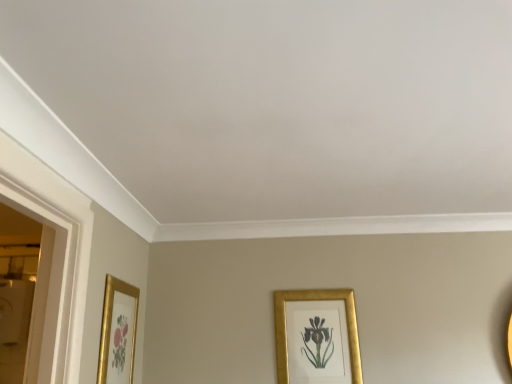
What do you see at coordinates (118, 332) in the screenshot?
I see `gold metallic picture frame at lower left, the 2th picture frame positioned from the back` at bounding box center [118, 332].

Find the location of a particular element. Image resolution: width=512 pixels, height=384 pixels. gold metallic picture frame at lower left, arranged as the second picture frame when viewed from the right is located at coordinates (118, 332).

Where is `gold metallic picture frame at lower center, marked as the second picture frame in a front-to-back arrangement`? The image size is (512, 384). gold metallic picture frame at lower center, marked as the second picture frame in a front-to-back arrangement is located at coordinates (317, 337).

Image resolution: width=512 pixels, height=384 pixels. What do you see at coordinates (317, 337) in the screenshot?
I see `gold metallic picture frame at lower center, which is the 1th picture frame in right-to-left order` at bounding box center [317, 337].

Image resolution: width=512 pixels, height=384 pixels. Find the location of `gold metallic picture frame at lower left, the 2th picture frame positioned from the back`. gold metallic picture frame at lower left, the 2th picture frame positioned from the back is located at coordinates (118, 332).

Does gold metallic picture frame at lower left, arranged as the second picture frame when viewed from the right, appear on the right side of gold metallic picture frame at lower center, marked as the second picture frame in a front-to-back arrangement?

Incorrect, gold metallic picture frame at lower left, arranged as the second picture frame when viewed from the right, is not on the right side of gold metallic picture frame at lower center, marked as the second picture frame in a front-to-back arrangement.

Considering the relative positions of gold metallic picture frame at lower left, the 2th picture frame positioned from the back, and gold metallic picture frame at lower center, which is the 1th picture frame in right-to-left order, in the image provided, is gold metallic picture frame at lower left, the 2th picture frame positioned from the back, behind gold metallic picture frame at lower center, which is the 1th picture frame in right-to-left order,?

No.

Does point (106, 306) come in front of point (302, 374)?

Yes, point (106, 306) is closer to viewer.

From the image's perspective, is gold metallic picture frame at lower left, the 1th picture frame viewed from the left, over gold metallic picture frame at lower center, marked as the first picture frame in a back-to-front arrangement?

Yes.

From a real-world perspective, is gold metallic picture frame at lower left, which ranks as the 1th picture frame in front-to-back order, physically located above or below gold metallic picture frame at lower center, marked as the second picture frame in a front-to-back arrangement?

Clearly, from a real-world perspective, gold metallic picture frame at lower left, which ranks as the 1th picture frame in front-to-back order, is above gold metallic picture frame at lower center, marked as the second picture frame in a front-to-back arrangement.

Is gold metallic picture frame at lower left, arranged as the second picture frame when viewed from the right, wider than gold metallic picture frame at lower center, marked as the first picture frame in a back-to-front arrangement?

No, gold metallic picture frame at lower left, arranged as the second picture frame when viewed from the right, is not wider than gold metallic picture frame at lower center, marked as the first picture frame in a back-to-front arrangement.

Based on the photo, who is taller, gold metallic picture frame at lower left, the 1th picture frame viewed from the left, or gold metallic picture frame at lower center, which is the 1th picture frame in right-to-left order?

With more height is gold metallic picture frame at lower center, which is the 1th picture frame in right-to-left order.

Based on the photo, between gold metallic picture frame at lower left, which ranks as the 1th picture frame in front-to-back order, and gold metallic picture frame at lower center, which is the 1th picture frame in right-to-left order, which one has smaller size?

With smaller size is gold metallic picture frame at lower left, which ranks as the 1th picture frame in front-to-back order.

Is gold metallic picture frame at lower left, arranged as the second picture frame when viewed from the right, positioned beyond the bounds of gold metallic picture frame at lower center, which is the 1th picture frame in right-to-left order?

Yes, gold metallic picture frame at lower left, arranged as the second picture frame when viewed from the right, is outside of gold metallic picture frame at lower center, which is the 1th picture frame in right-to-left order.

Would you consider gold metallic picture frame at lower left, the 1th picture frame viewed from the left, to be distant from gold metallic picture frame at lower center, which is the 1th picture frame in right-to-left order?

No.

Is gold metallic picture frame at lower left, the 2th picture frame positioned from the back, turned away from gold metallic picture frame at lower center, placed as the 2th picture frame when sorted from left to right?

No, gold metallic picture frame at lower left, the 2th picture frame positioned from the back,'s orientation is not away from gold metallic picture frame at lower center, placed as the 2th picture frame when sorted from left to right.

How many degrees apart are the facing directions of gold metallic picture frame at lower left, arranged as the second picture frame when viewed from the right, and gold metallic picture frame at lower center, placed as the 2th picture frame when sorted from left to right?

They differ by 89.2 degrees in their facing directions.

Consider the image. Measure the distance between gold metallic picture frame at lower left, which ranks as the 1th picture frame in front-to-back order, and gold metallic picture frame at lower center, marked as the first picture frame in a back-to-front arrangement.

A distance of 27.79 inches exists between gold metallic picture frame at lower left, which ranks as the 1th picture frame in front-to-back order, and gold metallic picture frame at lower center, marked as the first picture frame in a back-to-front arrangement.

Identify the location of picture frame behind the gold metallic picture frame at lower left, the 2th picture frame positioned from the back. (317, 337).

Between gold metallic picture frame at lower center, which is the 1th picture frame in right-to-left order, and gold metallic picture frame at lower left, arranged as the second picture frame when viewed from the right, which one appears on the right side from the viewer's perspective?

From the viewer's perspective, gold metallic picture frame at lower center, which is the 1th picture frame in right-to-left order, appears more on the right side.

Considering their positions, is gold metallic picture frame at lower center, which is the 1th picture frame in right-to-left order, located in front of or behind gold metallic picture frame at lower left, arranged as the second picture frame when viewed from the right?

gold metallic picture frame at lower center, which is the 1th picture frame in right-to-left order, is positioned farther from the viewer than gold metallic picture frame at lower left, arranged as the second picture frame when viewed from the right.

Between point (362, 380) and point (133, 321), which one is positioned in front?

Positioned in front is point (133, 321).

In the scene shown: From the image's perspective, does gold metallic picture frame at lower center, marked as the first picture frame in a back-to-front arrangement, appear lower than gold metallic picture frame at lower left, the 2th picture frame positioned from the back?

Yes, from the image's perspective, gold metallic picture frame at lower center, marked as the first picture frame in a back-to-front arrangement, is below gold metallic picture frame at lower left, the 2th picture frame positioned from the back.

From a real-world perspective, which is physically below, gold metallic picture frame at lower center, which is the 1th picture frame in right-to-left order, or gold metallic picture frame at lower left, the 2th picture frame positioned from the back?

gold metallic picture frame at lower center, which is the 1th picture frame in right-to-left order.

Which of these two, gold metallic picture frame at lower center, marked as the first picture frame in a back-to-front arrangement, or gold metallic picture frame at lower left, the 1th picture frame viewed from the left, is wider?

gold metallic picture frame at lower center, marked as the first picture frame in a back-to-front arrangement, is wider.

Considering the sizes of gold metallic picture frame at lower center, placed as the 2th picture frame when sorted from left to right, and gold metallic picture frame at lower left, the 2th picture frame positioned from the back, in the image, is gold metallic picture frame at lower center, placed as the 2th picture frame when sorted from left to right, taller or shorter than gold metallic picture frame at lower left, the 2th picture frame positioned from the back,?

In the image, gold metallic picture frame at lower center, placed as the 2th picture frame when sorted from left to right, appears to be taller than gold metallic picture frame at lower left, the 2th picture frame positioned from the back.

Which of these two, gold metallic picture frame at lower center, which is the 1th picture frame in right-to-left order, or gold metallic picture frame at lower left, the 2th picture frame positioned from the back, is bigger?

With larger size is gold metallic picture frame at lower center, which is the 1th picture frame in right-to-left order.

Would you say gold metallic picture frame at lower center, placed as the 2th picture frame when sorted from left to right, is inside or outside gold metallic picture frame at lower left, the 2th picture frame positioned from the back?

gold metallic picture frame at lower center, placed as the 2th picture frame when sorted from left to right, is not inside gold metallic picture frame at lower left, the 2th picture frame positioned from the back, it's outside.

Is there a large distance between gold metallic picture frame at lower center, marked as the first picture frame in a back-to-front arrangement, and gold metallic picture frame at lower left, arranged as the second picture frame when viewed from the right?

They are positioned close to each other.

Is gold metallic picture frame at lower center, placed as the 2th picture frame when sorted from left to right, oriented away from gold metallic picture frame at lower left, arranged as the second picture frame when viewed from the right?

That's not correct — gold metallic picture frame at lower center, placed as the 2th picture frame when sorted from left to right, is not looking away from gold metallic picture frame at lower left, arranged as the second picture frame when viewed from the right.

What's the angular difference between gold metallic picture frame at lower center, marked as the second picture frame in a front-to-back arrangement, and gold metallic picture frame at lower left, which ranks as the 1th picture frame in front-to-back order,'s facing directions?

89.2 degrees.

This screenshot has height=384, width=512. What are the coordinates of `picture frame above the gold metallic picture frame at lower center, which is the 1th picture frame in right-to-left order (from a real-world perspective)` in the screenshot? It's located at (118, 332).

Identify the location of picture frame lying in front of the gold metallic picture frame at lower center, placed as the 2th picture frame when sorted from left to right. (118, 332).

I want to click on picture frame located on the left of gold metallic picture frame at lower center, marked as the second picture frame in a front-to-back arrangement, so click(118, 332).